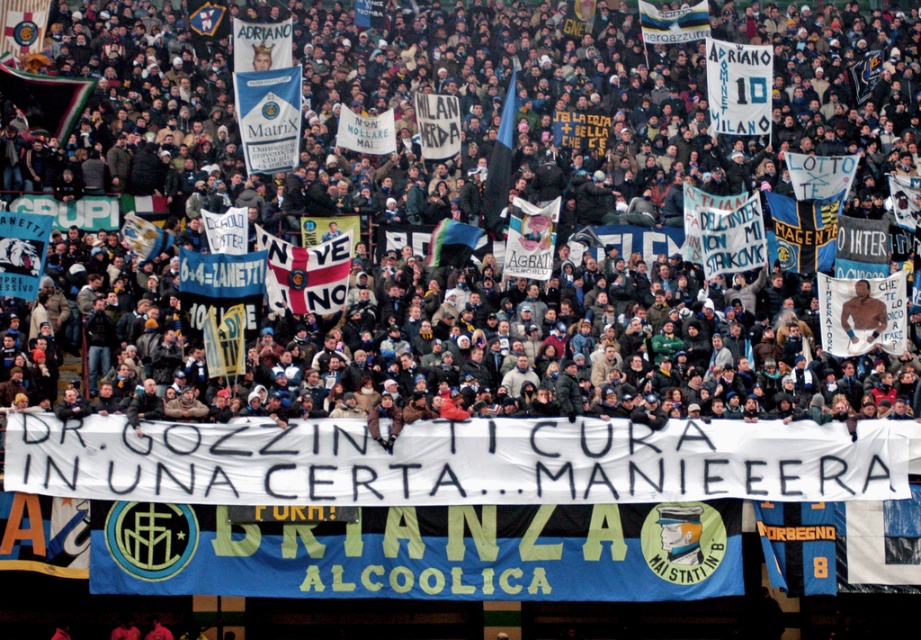
Question: Which is farther from the blue fabric flag at center?

Choices:
 (A) white fabric banner at center
 (B) white paper flag at center
 (C) white paper banner at center

Answer: (A)

Question: Is red and white striped flag at center to the right of brown leather jacket at center from the viewer's perspective?

Choices:
 (A) no
 (B) yes

Answer: (A)

Question: Does white paper banner at center have a smaller size compared to white paper flag at center?

Choices:
 (A) yes
 (B) no

Answer: (B)

Question: Which is nearer to the blue and white striped flag at upper center?

Choices:
 (A) brown leather jacket at center
 (B) blue fabric flag at center
 (C) red and white striped flag at center
 (D) white fabric banner at center

Answer: (B)

Question: Which object is farther from the camera taking this photo?

Choices:
 (A) brown leather jacket at center
 (B) blue and white striped flag at upper center
 (C) white paper flag at center

Answer: (B)

Question: Does red and white striped flag at center have a smaller size compared to white paper flag at center?

Choices:
 (A) no
 (B) yes

Answer: (A)